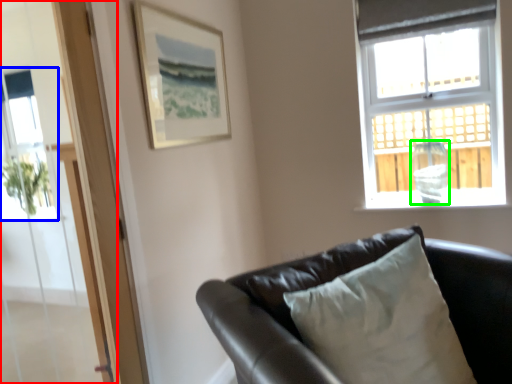
Question: Which object is positioned closest to screen door (highlighted by a red box)? Select from window screen (highlighted by a blue box) and glass vase (highlighted by a green box).

Choices:
 (A) window screen
 (B) glass vase

Answer: (A)